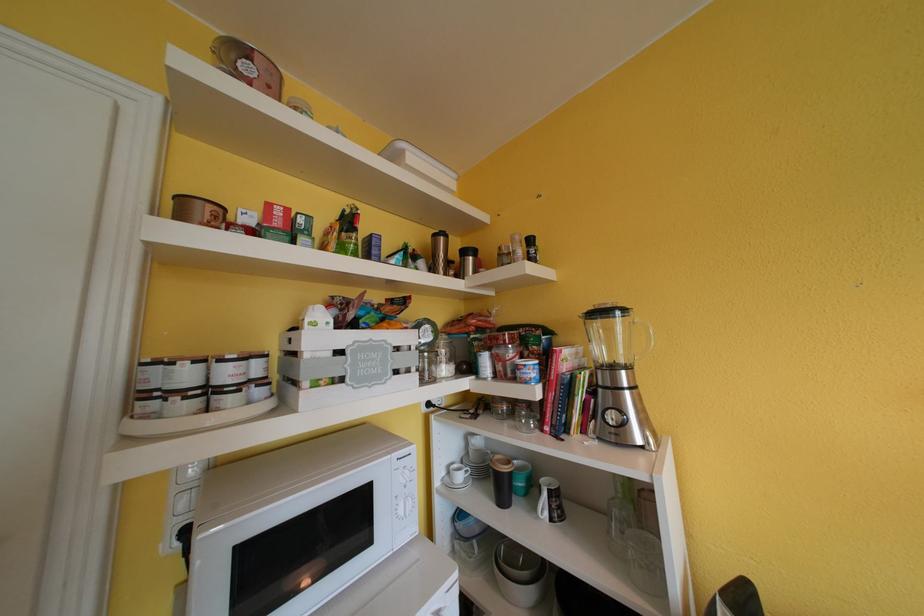
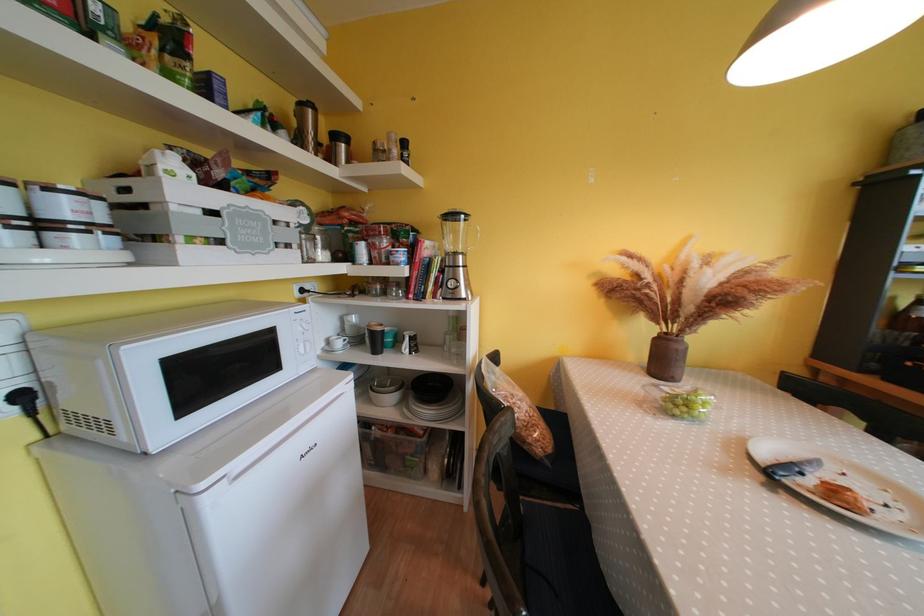
In the second image, find the point that corresponds to (x=408, y=516) in the first image.

(309, 355)